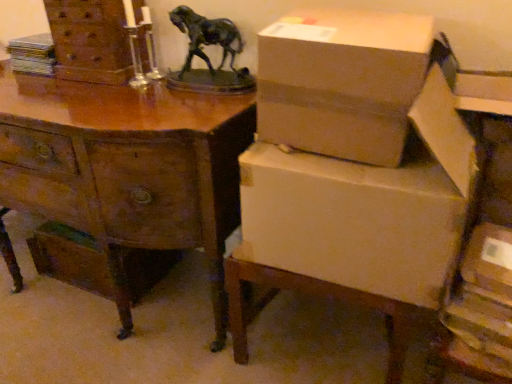
Question: Does point (112, 62) appear closer or farther from the camera than point (22, 198)?

Choices:
 (A) closer
 (B) farther

Answer: (B)

Question: In the image, is wooden chest of drawers at upper left on the left side or the right side of wooden desk at center?

Choices:
 (A) right
 (B) left

Answer: (A)

Question: Estimate the real-world distances between objects in this image. Which object is farther from the white cardboard box at lower right?

Choices:
 (A) matte cardboard box at lower right
 (B) cardboard box at upper right
 (C) wooden desk at center
 (D) wooden chest of drawers at upper left

Answer: (D)

Question: Based on their relative distances, which object is farther from the white cardboard box at lower right?

Choices:
 (A) matte cardboard box at lower right
 (B) cardboard box at upper right
 (C) wooden chest of drawers at upper left
 (D) wooden desk at center

Answer: (C)